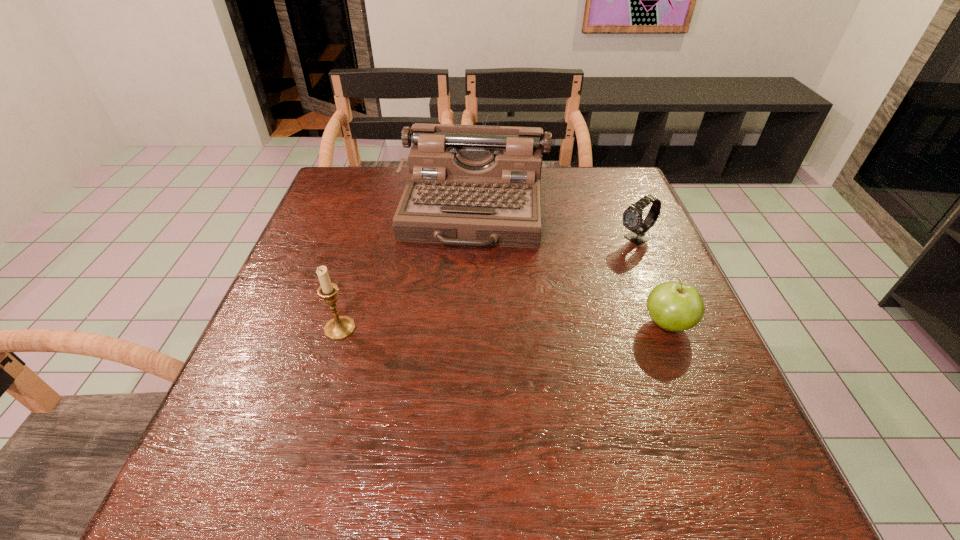
In the image, there is a desktop. Where is `vacant region at the far left corner`? vacant region at the far left corner is located at coordinates (356, 166).

Find the location of a particular element. vacant space at the far right corner is located at coordinates (602, 166).

This screenshot has height=540, width=960. I want to click on free location at the near right corner of the desktop, so click(x=652, y=393).

Where is `vacant space that's between the watch and the tallest object`? The width and height of the screenshot is (960, 540). vacant space that's between the watch and the tallest object is located at coordinates (556, 224).

The width and height of the screenshot is (960, 540). In order to click on free spot between the watch and the apple in this screenshot , I will do `click(652, 282)`.

Identify the location of vacant space that's between the watch and the apple. The image size is (960, 540). (652, 282).

You are a GUI agent. You are given a task and a screenshot of the screen. Output one action in this format:
    pyautogui.click(x=<x>, y=<y>)
    Task: Click on the vacant area between the watch and the apple
    The width and height of the screenshot is (960, 540).
    Given the screenshot: What is the action you would take?
    pyautogui.click(x=652, y=282)

The height and width of the screenshot is (540, 960). I want to click on free space between the apple and the watch, so click(x=652, y=282).

Find the location of a particular element. Image resolution: width=960 pixels, height=540 pixels. free space between the watch and the apple is located at coordinates [x=652, y=282].

Identify the location of empty space that is in between the watch and the typewriter. (556, 224).